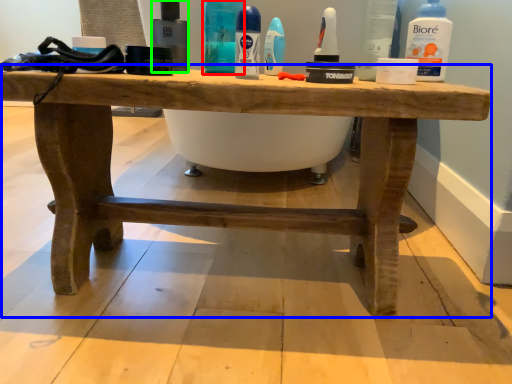
Question: Which is farther away from cleaning product (highlighted by a red box)? table (highlighted by a blue box) or mouthwash (highlighted by a green box)?

Choices:
 (A) table
 (B) mouthwash

Answer: (A)